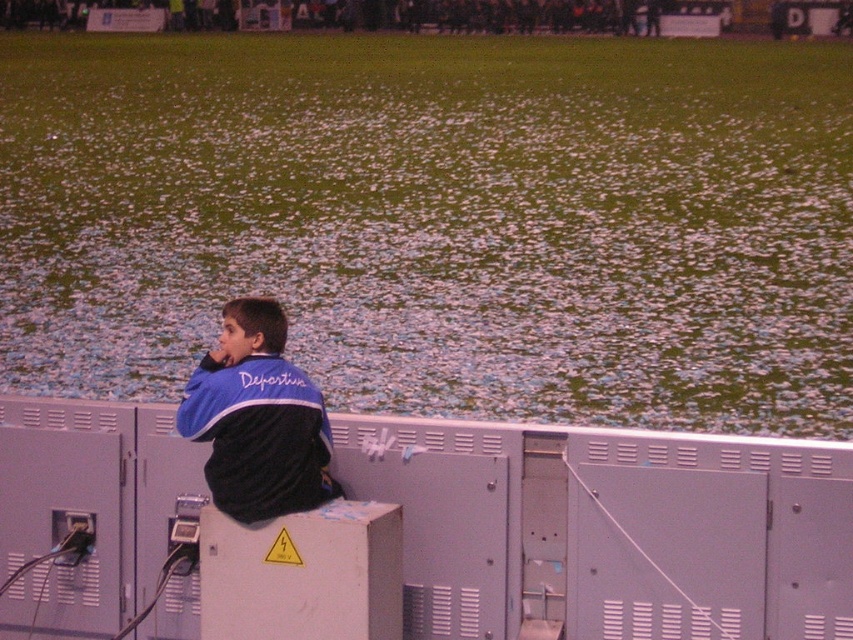
You are a photographer trying to capture the best angle of the green grass at center and the blue fleece jacket at upper left. Based on their positions, which object should you focus on first if you want to start with the one closer to the camera?

The blue fleece jacket at upper left is closer to the camera than the green grass at center, so you should focus on the blue fleece jacket at upper left first.

You are a photographer positioned at the edge of the field. You want to capture a photo that includes both the green grass at center and the blue fleece jacket at upper left. Which object should you pan your camera towards first to ensure both are in frame?

You should pan your camera towards the blue fleece jacket at upper left first because the green grass at center is to the right of it, so starting from the jacket and moving right will include both in the frame.